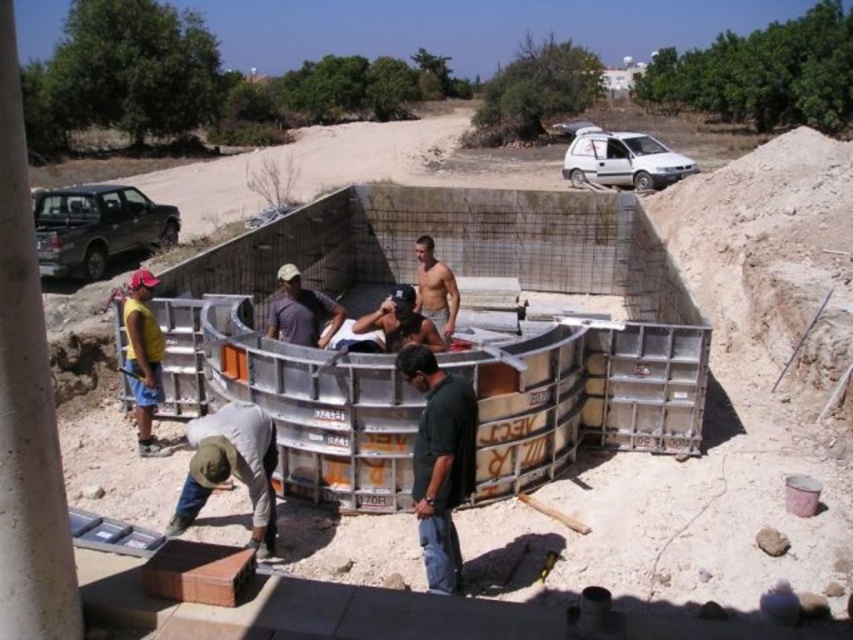
You are a construction supervisor standing at the edge of the construction site. You see two points marked on the ground at coordinates point (448, 456) and point (138, 372). Which point is closer to you?

Point (448, 456) is closer to the viewer than point (138, 372).